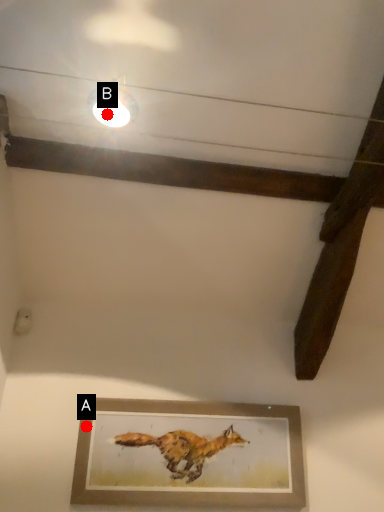
Question: Two points are circled on the image, labeled by A and B beside each circle. Which point is closer to the camera taking this photo?

Choices:
 (A) A is closer
 (B) B is closer

Answer: (B)